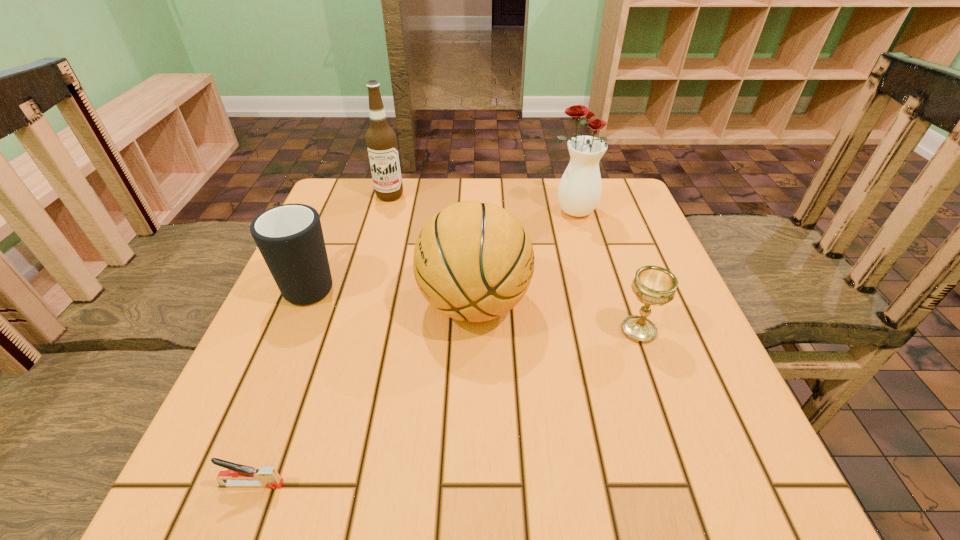
This screenshot has height=540, width=960. I want to click on vacant space that satisfies the following two spatial constraints: 1. on the label of the alcohol; 2. on the handle side of the nearest object, so click(x=308, y=484).

The height and width of the screenshot is (540, 960). Identify the location of free space that satisfies the following two spatial constraints: 1. on the front side of the fifth tallest object; 2. on the handle side of the stapler. (693, 484).

The height and width of the screenshot is (540, 960). Find the location of `vacant area that satisfies the following two spatial constraints: 1. on the label of the alcohol; 2. on the handle side of the nearest object`. vacant area that satisfies the following two spatial constraints: 1. on the label of the alcohol; 2. on the handle side of the nearest object is located at coordinates (308, 484).

Where is `free region that satisfies the following two spatial constraints: 1. on the back side of the fifth tallest object; 2. on the surface of the fourth object from left to right near the brand logo`? This screenshot has height=540, width=960. free region that satisfies the following two spatial constraints: 1. on the back side of the fifth tallest object; 2. on the surface of the fourth object from left to right near the brand logo is located at coordinates (630, 304).